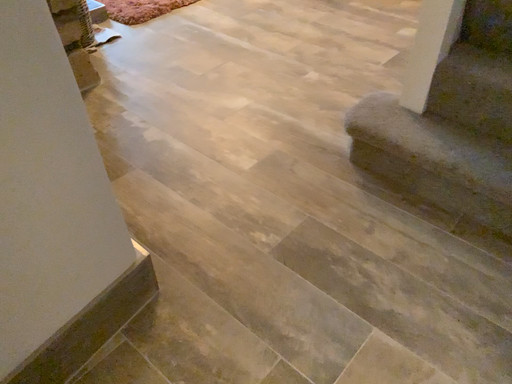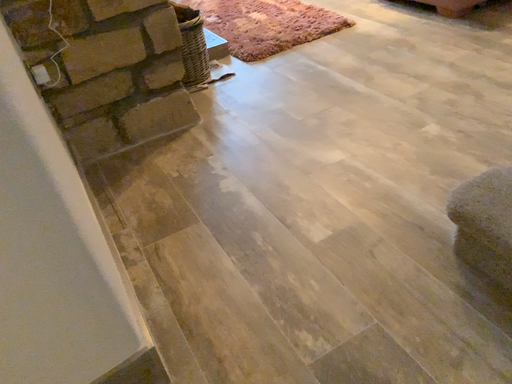
Question: Which way did the camera rotate in the video?

Choices:
 (A) rotated left
 (B) rotated right

Answer: (A)